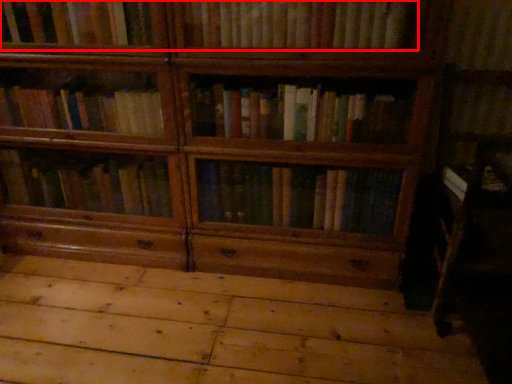
Question: Where is book (annotated by the red box) located in relation to plywood in the image?

Choices:
 (A) right
 (B) left

Answer: (A)